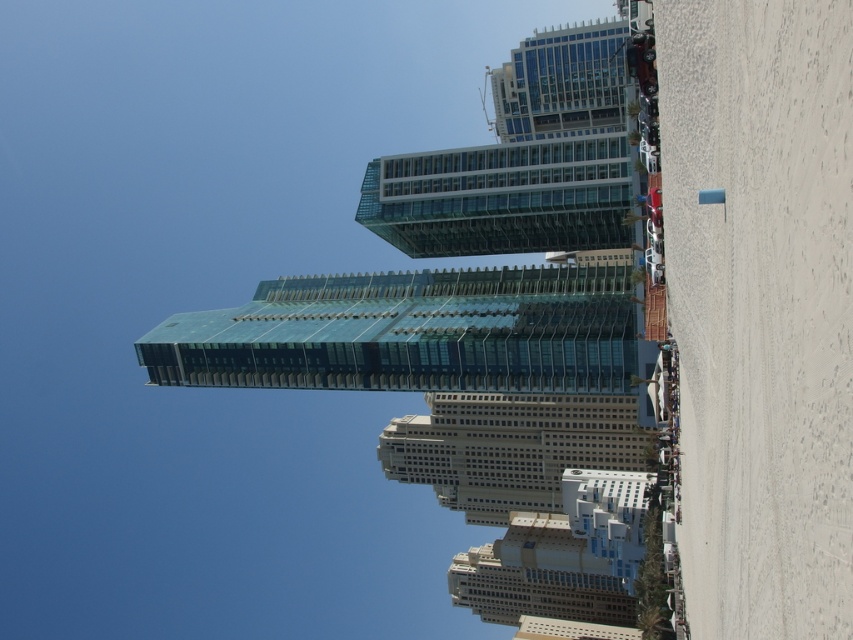
Does transparent glass tower at center lie in front of beige stone building at center?

That is True.

Who is more forward, (428,380) or (511,499)?

Point (428,380) is more forward.

Locate an element on the screen. The width and height of the screenshot is (853, 640). transparent glass tower at center is located at coordinates (410, 333).